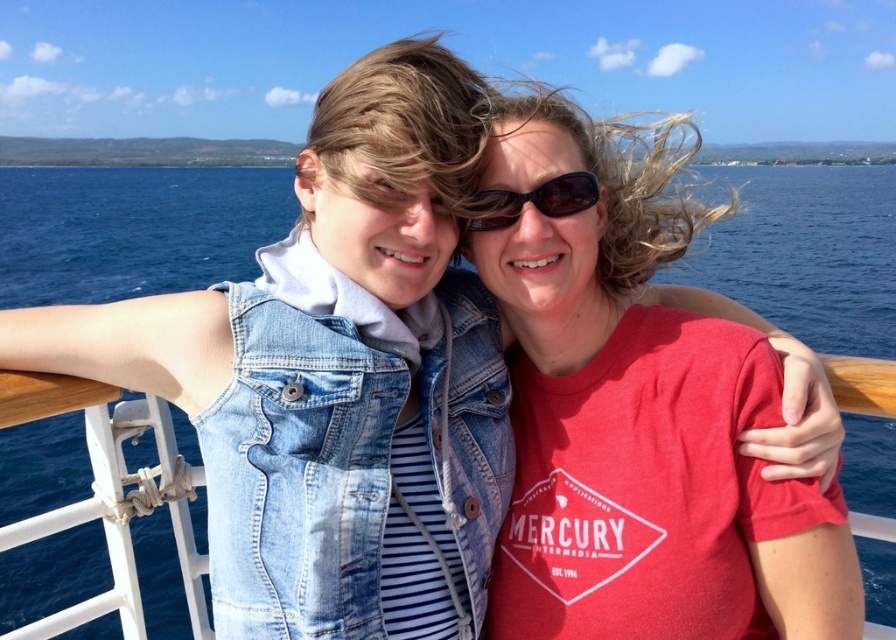
Question: Which object is positioned closest to the matte red t-shirt at center?

Choices:
 (A) faded denim jacket at lower right
 (B) blue water at center
 (C) black plastic sunglasses at center

Answer: (C)

Question: Is blue water at center thinner than black plastic sunglasses at center?

Choices:
 (A) yes
 (B) no

Answer: (B)

Question: Can you confirm if faded denim jacket at lower right is positioned above black plastic sunglasses at center?

Choices:
 (A) no
 (B) yes

Answer: (A)

Question: Which of the following is the closest to the observer?

Choices:
 (A) black plastic sunglasses at center
 (B) faded denim jacket at lower right
 (C) blue water at center

Answer: (B)

Question: Which object is farther from the camera taking this photo?

Choices:
 (A) faded denim jacket at lower right
 (B) matte red t-shirt at center
 (C) black plastic sunglasses at center
 (D) blue water at center

Answer: (D)

Question: Observing the image, what is the correct spatial positioning of faded denim jacket at lower right in reference to black plastic sunglasses at center?

Choices:
 (A) above
 (B) below

Answer: (B)